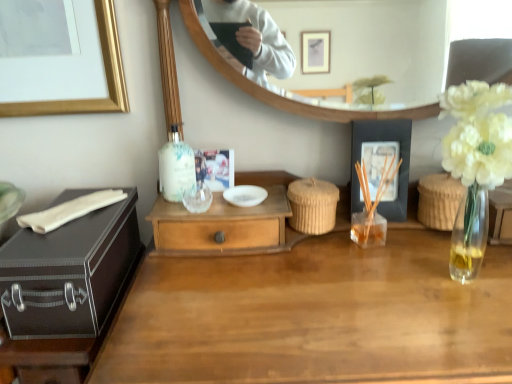
Identify the location of free space in front of wooden drawer at center. (224, 288).